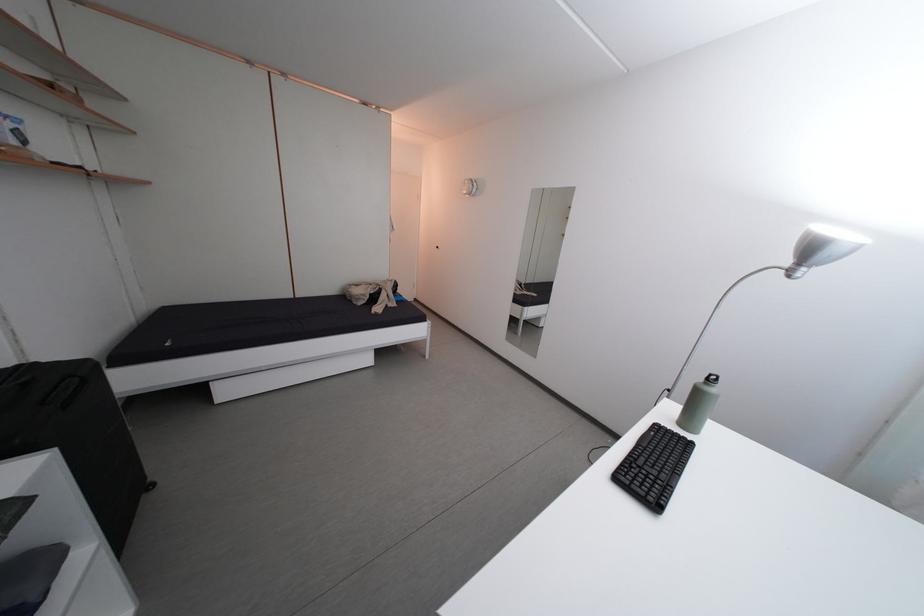
What do you see at coordinates (824, 245) in the screenshot? I see `the silver lamp head` at bounding box center [824, 245].